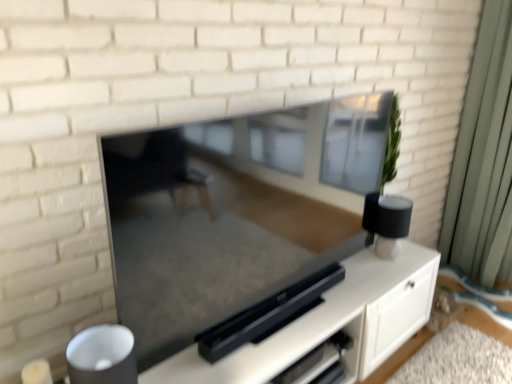
Question: Would you say matte black tv at center is outside green fabric curtain at right?

Choices:
 (A) no
 (B) yes

Answer: (B)

Question: Considering the relative sizes of matte black tv at center and green fabric curtain at right in the image provided, is matte black tv at center smaller than green fabric curtain at right?

Choices:
 (A) no
 (B) yes

Answer: (B)

Question: From the image's perspective, does matte black tv at center appear lower than green fabric curtain at right?

Choices:
 (A) no
 (B) yes

Answer: (B)

Question: From a real-world perspective, is matte black tv at center under green fabric curtain at right?

Choices:
 (A) no
 (B) yes

Answer: (A)

Question: Is matte black tv at center touching green fabric curtain at right?

Choices:
 (A) no
 (B) yes

Answer: (A)

Question: Considering the relative positions of matte black tv at center and green fabric curtain at right in the image provided, is matte black tv at center to the right of green fabric curtain at right from the viewer's perspective?

Choices:
 (A) yes
 (B) no

Answer: (B)

Question: Is matte black tv at center aimed at satin black entertainment center at center?

Choices:
 (A) yes
 (B) no

Answer: (B)

Question: Can you confirm if matte black tv at center is positioned to the left of satin black entertainment center at center?

Choices:
 (A) no
 (B) yes

Answer: (B)

Question: From the image's perspective, would you say matte black tv at center is positioned over satin black entertainment center at center?

Choices:
 (A) yes
 (B) no

Answer: (A)

Question: Considering the relative positions of matte black tv at center and satin black entertainment center at center in the image provided, is matte black tv at center to the right of satin black entertainment center at center from the viewer's perspective?

Choices:
 (A) yes
 (B) no

Answer: (B)

Question: Is matte black tv at center touching satin black entertainment center at center?

Choices:
 (A) yes
 (B) no

Answer: (B)

Question: Does matte black tv at center lie in front of satin black entertainment center at center?

Choices:
 (A) no
 (B) yes

Answer: (B)

Question: Is satin black entertainment center at center positioned behind green fabric curtain at right?

Choices:
 (A) no
 (B) yes

Answer: (A)